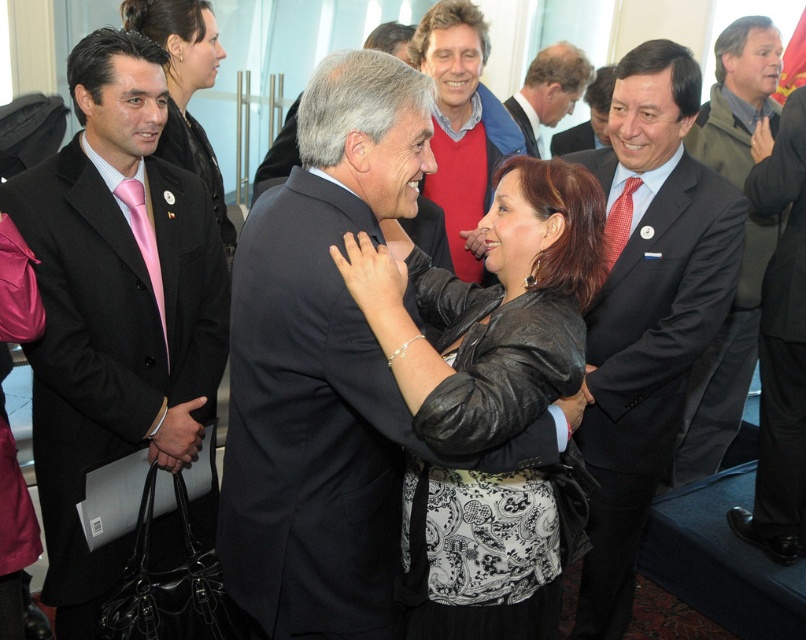
Question: Which point is closer to the camera?

Choices:
 (A) (503, 102)
 (B) (746, 180)
 (C) (626, 388)

Answer: (C)

Question: Does green woolen sweater at upper right appear on the right side of light brown leather jacket at upper center?

Choices:
 (A) no
 (B) yes

Answer: (B)

Question: Which of these objects is positioned closest to the green woolen sweater at upper right?

Choices:
 (A) matte black suit at upper right
 (B) black matte suit at center
 (C) matte black jacket at upper left

Answer: (A)

Question: Is the position of black matte suit at center more distant than that of green woolen sweater at upper right?

Choices:
 (A) yes
 (B) no

Answer: (B)

Question: Which of the following is the closest to the observer?

Choices:
 (A) (725, 56)
 (B) (601, 140)
 (C) (231, 561)
 (D) (804, 378)

Answer: (C)

Question: Can you confirm if dark gray suit at center is wider than matte black suit at upper right?

Choices:
 (A) yes
 (B) no

Answer: (B)